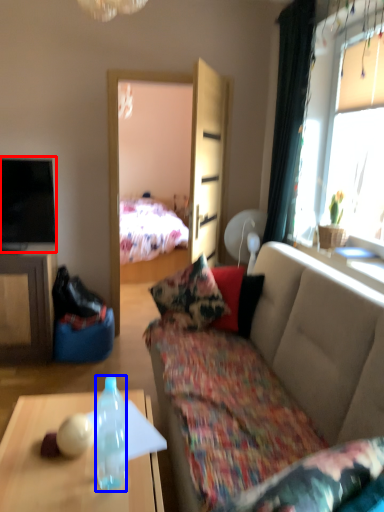
Question: Which of the following is the farthest to the observer, television (highlighted by a red box) or bottle (highlighted by a blue box)?

Choices:
 (A) television
 (B) bottle

Answer: (A)